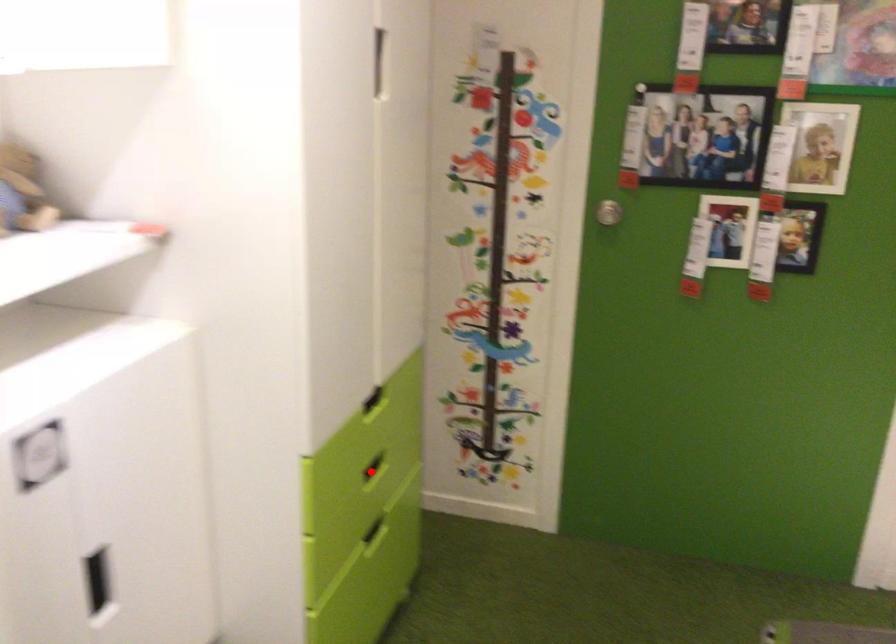
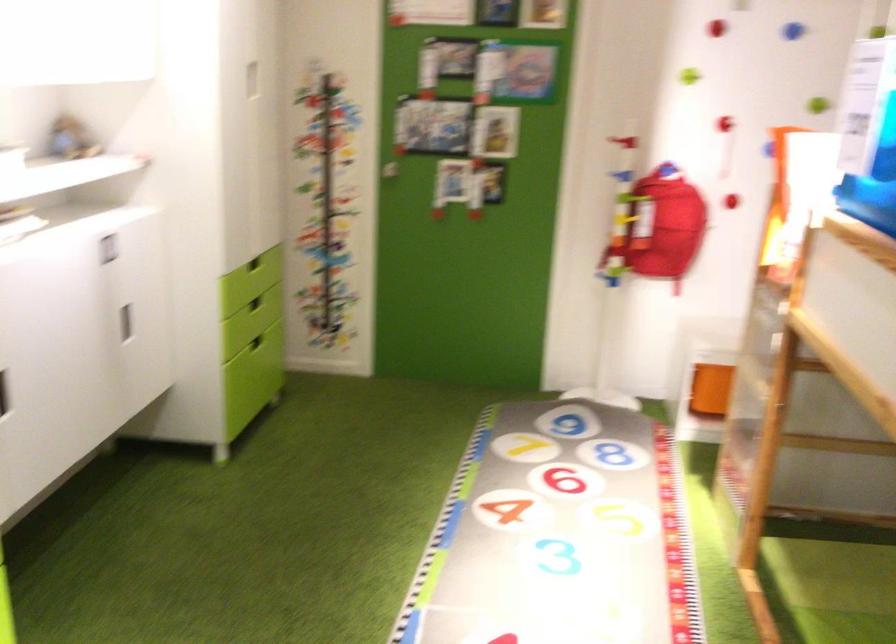
Find the pixel in the second image that matches the highlighted location in the first image.

(254, 303)